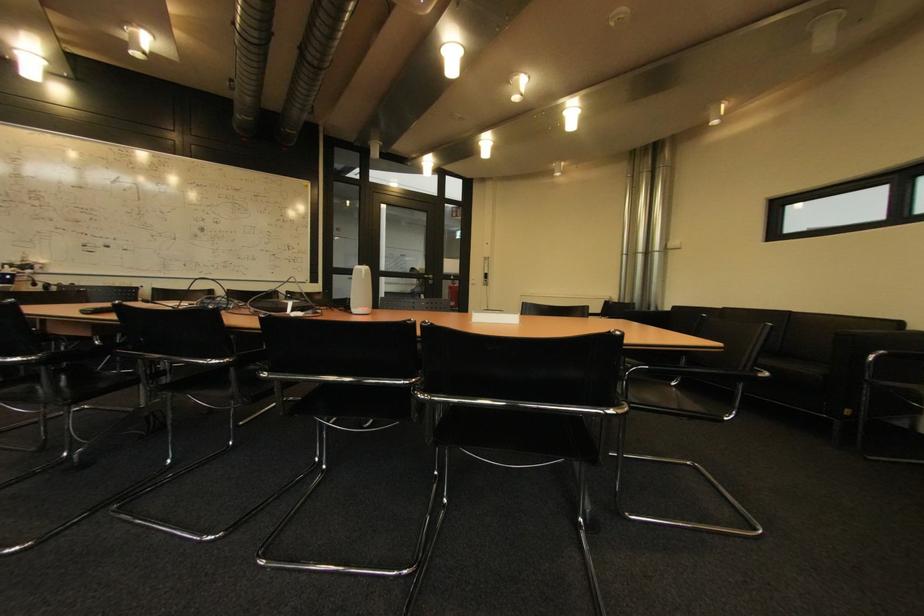
Describe the element at coordinates (427, 277) in the screenshot. The height and width of the screenshot is (616, 924). I see `the vertical door handle` at that location.